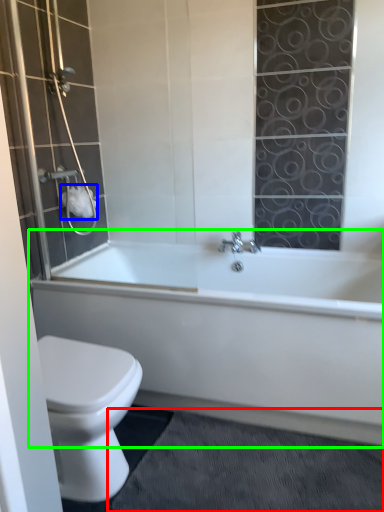
Question: Estimate the real-world distances between objects in this image. Which object is closer to bath mat (highlighted by a red box), toilet paper (highlighted by a blue box) or bathtub (highlighted by a green box)?

Choices:
 (A) toilet paper
 (B) bathtub

Answer: (B)